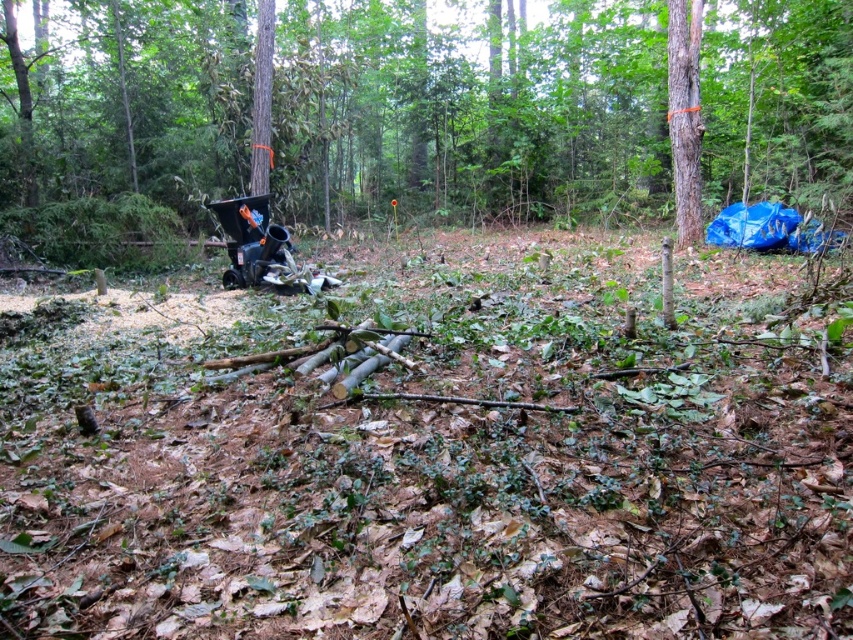
Question: In this image, where is smooth bark tree at right located relative to matte black baby carriage at center?

Choices:
 (A) left
 (B) right

Answer: (B)

Question: Which object is positioned farthest from the brown wood tree at center?

Choices:
 (A) smooth bark tree at center
 (B) matte black baby carriage at center
 (C) smooth bark tree at right

Answer: (B)

Question: Which point is closer to the camera?

Choices:
 (A) smooth bark tree at center
 (B) matte black baby carriage at center

Answer: (B)

Question: Is brown wood tree at center bigger than smooth bark tree at center?

Choices:
 (A) yes
 (B) no

Answer: (A)

Question: Does brown wood tree at center appear over smooth bark tree at center?

Choices:
 (A) no
 (B) yes

Answer: (B)

Question: Which of the following is the closest to the observer?

Choices:
 (A) matte black baby carriage at center
 (B) brown wood tree at center
 (C) smooth bark tree at right

Answer: (A)